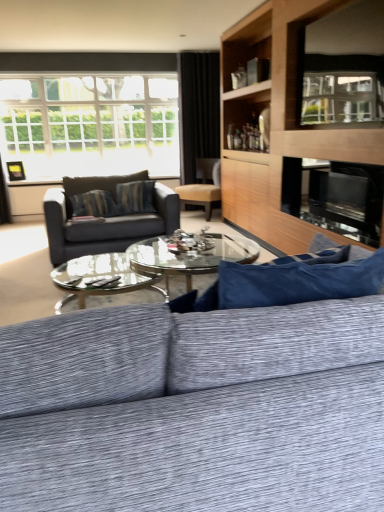
Question: From a real-world perspective, is black glass fireplace at center physically located above or below wooden entertainment center at upper right?

Choices:
 (A) below
 (B) above

Answer: (A)

Question: Considering the positions of point (367, 212) and point (238, 197), is point (367, 212) closer or farther from the camera than point (238, 197)?

Choices:
 (A) farther
 (B) closer

Answer: (B)

Question: Based on their relative distances, which object is farther from the black glass fireplace at center?

Choices:
 (A) white glass window at upper left
 (B) matte black couch at center, arranged as the 2th studio couch when viewed from the front
 (C) clear glass window screen at upper right
 (D) black fabric curtain at upper center
 (E) metallic gold picture frame at upper left

Answer: (E)

Question: Which is farther from the white glass window at upper left?

Choices:
 (A) textured gray couch at center, which ranks as the second studio couch in back-to-front order
 (B) matte brown chair at center
 (C) wooden entertainment center at upper right
 (D) black fabric curtain at upper center
 (E) matte black couch at center, marked as the first studio couch in a back-to-front arrangement

Answer: (A)